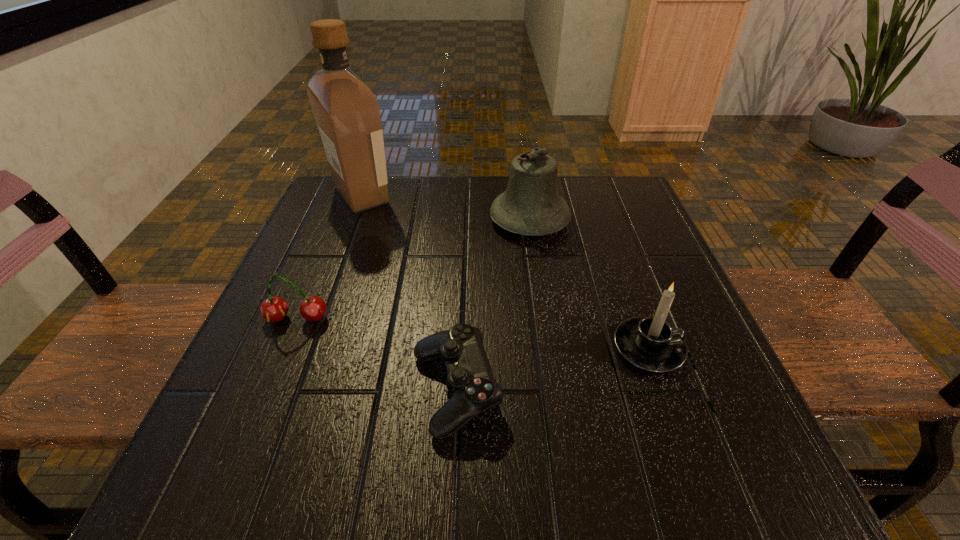
In the image, there is a desktop. Where is `vacant space at the right edge`? vacant space at the right edge is located at coordinates (590, 257).

This screenshot has height=540, width=960. Identify the location of vacant position at the far left corner of the desktop. (313, 228).

Where is `vacant point at the near left corner`? The image size is (960, 540). vacant point at the near left corner is located at coordinates (245, 436).

In the image, there is a desktop. Identify the location of free region at the far right corner. pos(584,183).

Locate an element on the screen. Image resolution: width=960 pixels, height=540 pixels. vacant area that lies between the bell and the shortest object is located at coordinates (492, 305).

At what (x,y) coordinates should I click in order to perform the action: click on free spot between the bell and the tallest object. Please return your answer as a coordinate pair (x, y). The height and width of the screenshot is (540, 960). Looking at the image, I should click on (445, 207).

Where is `unoccupied area between the bell and the second shortest object`? This screenshot has width=960, height=540. unoccupied area between the bell and the second shortest object is located at coordinates (414, 269).

Image resolution: width=960 pixels, height=540 pixels. I want to click on free area in between the shortest object and the rightmost object, so point(552,370).

Where is `empty location between the tallest object and the shortest object`? This screenshot has height=540, width=960. empty location between the tallest object and the shortest object is located at coordinates (409, 293).

You are a GUI agent. You are given a task and a screenshot of the screen. Output one action in this format:
    pyautogui.click(x=<x>, y=<y>)
    Task: Click on the empty space that is in between the tallest object and the shortest object
    
    Given the screenshot: What is the action you would take?
    pyautogui.click(x=409, y=293)